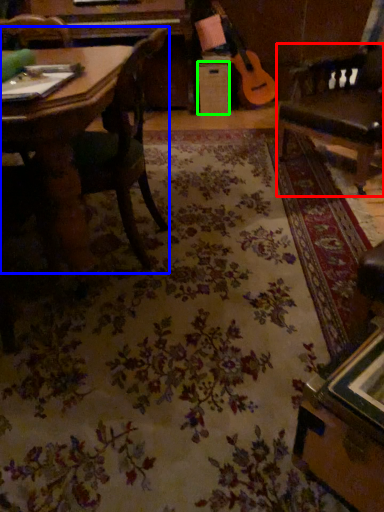
Question: Considering the real-world distances, which object is farthest from swivel chair (highlighted by a red box)? chair (highlighted by a blue box) or drawer (highlighted by a green box)?

Choices:
 (A) chair
 (B) drawer

Answer: (B)